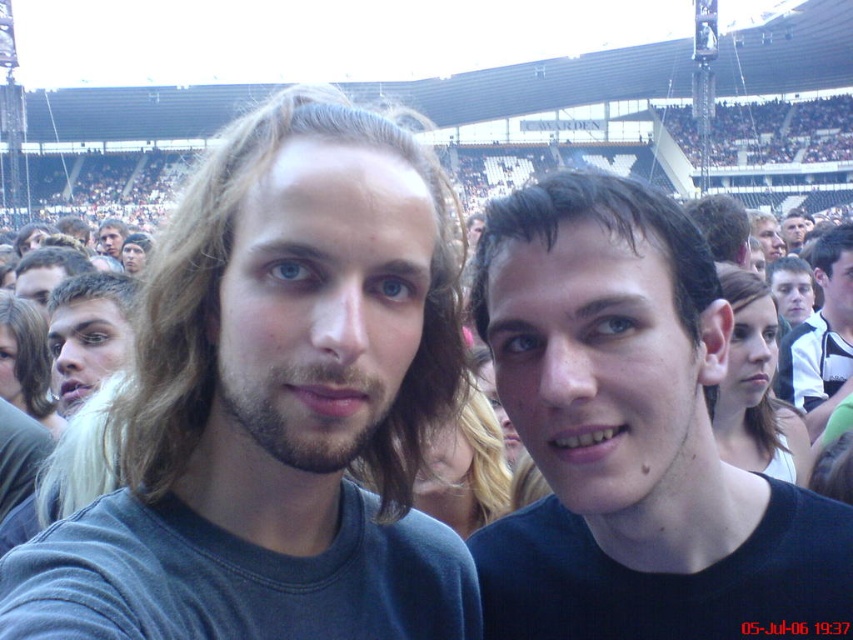
You are at an outdoor event and want to take a photo of two points marked in the scene. The first point is at coordinates point (793, 353) and the second point is at point (74, 380). Which point is closer to you?

Point (793, 353) is closer to you because it is further to the viewer than point (74, 380).

You are a photographer trying to capture a closeup shot of the blonde hair at left and the smooth skin face at center. Which object would require a wider aperture setting to ensure sharpness due to its size?

The smooth skin face at center requires a wider aperture setting because it is larger than the blonde hair at left, necessitating a shallower depth of field to keep it sharp while blurring the background.

You are standing in the crowd at this event and notice two points in the image. The first point is at coordinates point (144, 508) and the second is at point (807, 525). Which point is nearer to you?

Point (144, 508) is closer to the viewer than point (807, 525).